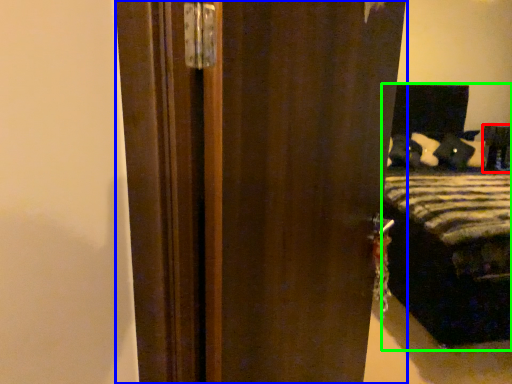
Question: Which is farther away from furniture (highlighted by a red box)? door (highlighted by a blue box) or bed (highlighted by a green box)?

Choices:
 (A) door
 (B) bed

Answer: (A)